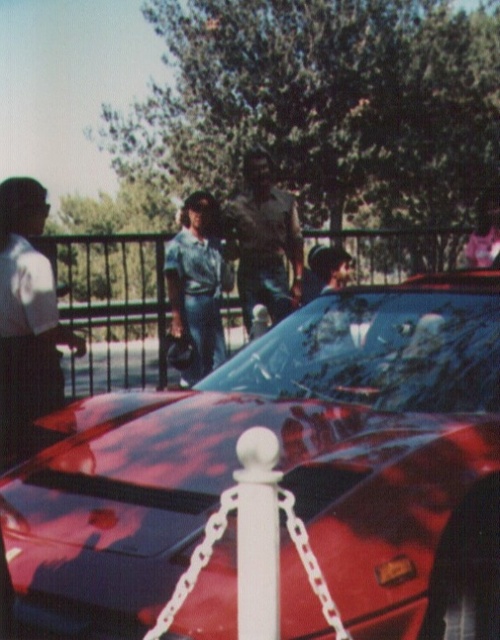
You are a photographer trying to capture a clear shot of the red sports car. There are two obstacles in your path, the white glossy pole at center and the denim jeans at center. Which obstacle is narrower and easier to maneuver around?

The white glossy pole at center is narrower than the denim jeans at center, so it would be easier to maneuver around the white glossy pole at center first.

You are a photographer trying to capture the clear glass windshield at center and the white glossy pole at center in the same frame. Based on their positions, which object should you adjust your camera to focus on first if you want to ensure both are in the shot?

The clear glass windshield at center is to the right of white glossy pole at center, so you should focus on the white glossy pole at center first to ensure both objects are within the frame.

You are a photographer trying to capture the clear glass windshield at center of the red sports car. Based on its position, where should you aim your camera to ensure the windshield is centered in your shot?

To center the clear glass windshield at center in your shot, aim your camera at the coordinates point (378, 352).